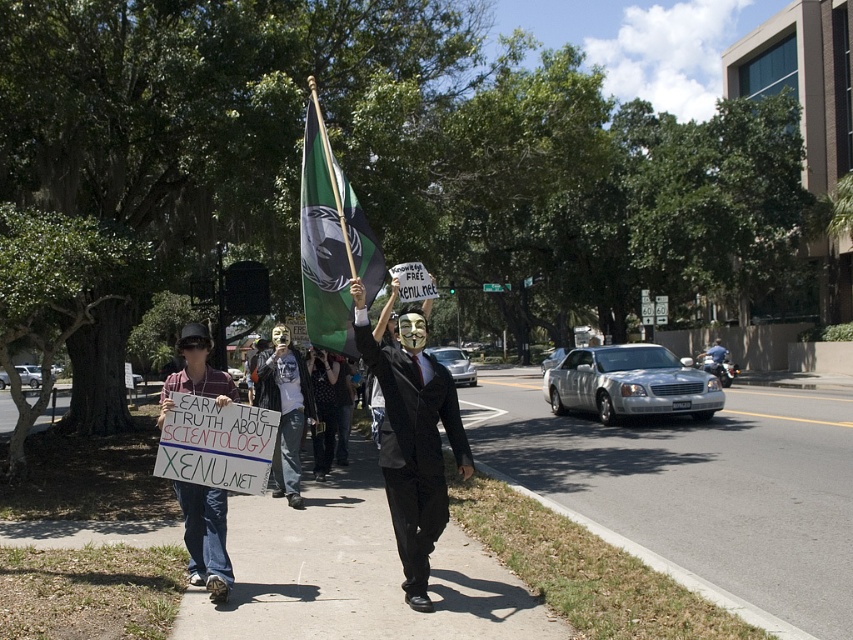
Between asphalt at lower center and smooth concrete sidewalk at center, which one appears on the right side from the viewer's perspective?

Positioned to the right is asphalt at lower center.

Can you confirm if asphalt at lower center is wider than smooth concrete sidewalk at center?

Yes, asphalt at lower center is wider than smooth concrete sidewalk at center.

At what (x,y) coordinates should I click in order to perform the action: click on asphalt at lower center. Please return your answer as a coordinate pair (x, y). Looking at the image, I should click on (698, 484).

Can you confirm if asphalt at lower center is positioned to the right of green fabric flag at center?

Yes, asphalt at lower center is to the right of green fabric flag at center.

Is asphalt at lower center positioned behind green fabric flag at center?

No, it is not.

I want to click on asphalt at lower center, so click(698, 484).

Which is behind, point (427, 604) or point (350, 195)?

Positioned behind is point (350, 195).

In the scene shown: Is matte black suit at center positioned before green fabric flag at center?

Yes, it is in front of green fabric flag at center.

Does point (444, 486) come behind point (334, 291)?

That is False.

This screenshot has width=853, height=640. In order to click on matte black suit at center in this screenshot , I will do `click(412, 440)`.